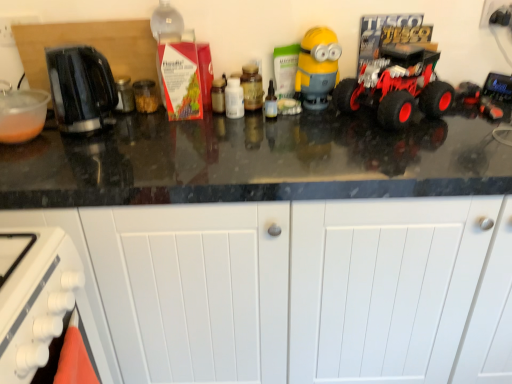
This screenshot has width=512, height=384. I want to click on spots to the right of black plastic toaster at left, so click(140, 135).